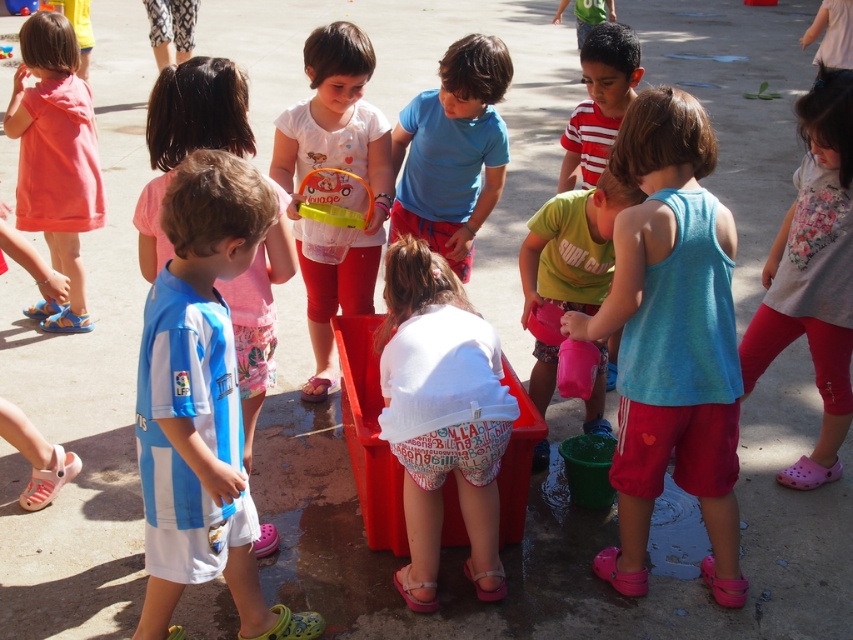
Question: Which point is farther to the camera?

Choices:
 (A) (259, 406)
 (B) (585, 300)
 (C) (608, 140)

Answer: (C)

Question: Is white matte shirt at center above matte green shirt at center?

Choices:
 (A) yes
 (B) no

Answer: (A)

Question: Observing the image, what is the correct spatial positioning of pink fabric pants at lower right in reference to matte pink dress at left?

Choices:
 (A) above
 (B) below

Answer: (B)

Question: Which of these objects is positioned closest to the blue and white jersey at left?

Choices:
 (A) matte green shirt at center
 (B) white cotton shirt at center
 (C) pink fabric pants at lower right
 (D) light blue tank top at center

Answer: (B)

Question: Based on their relative distances, which object is nearer to the white cotton shirt at center?

Choices:
 (A) white matte shirt at center
 (B) blue cotton shirt at center
 (C) light blue tank top at center
 (D) matte pink dress at left

Answer: (C)

Question: Can you confirm if blue and white jersey at left is positioned to the right of blue cotton shirt at center?

Choices:
 (A) yes
 (B) no

Answer: (B)